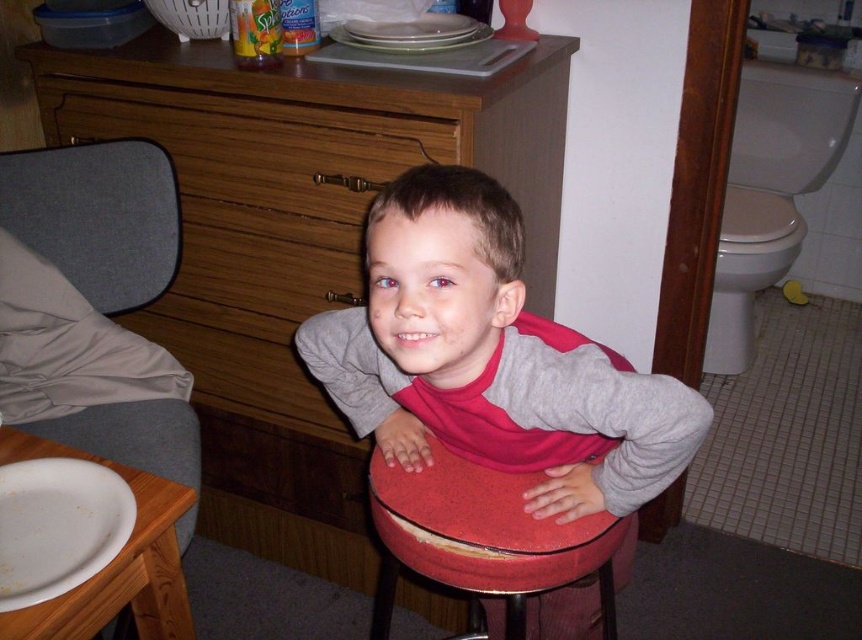
You are standing in the room and want to move from the matte wood dresser at center to the matte red stool at center. Which direction should you move to reach the stool?

The matte wood dresser at center is to the left of the matte red stool at center, so you should move to the right to reach the matte red stool at center.

Looking at this image, you are a delivery person holding a 1.2 meter long package. You need to place it on the matte wood dresser at center. Can you fit the package on the dresser without it hanging over the edge? Please explain your reasoning.

The distance of matte wood dresser at center from viewer is 1.15 meters. Since the package is 1.2 meters long, it is slightly longer than the dresser. Therefore, the package will hang over the edge by 0.05 meters.

Looking at this image, you are standing in the room and want to place a new decorative item on the matte red stool at center. According to the image, where exactly should you place it?

The matte red stool at center is located at point (x=491, y=358), so you should place the decorative item at those coordinates on the stool.